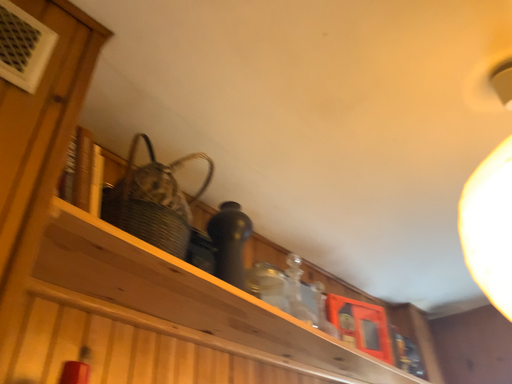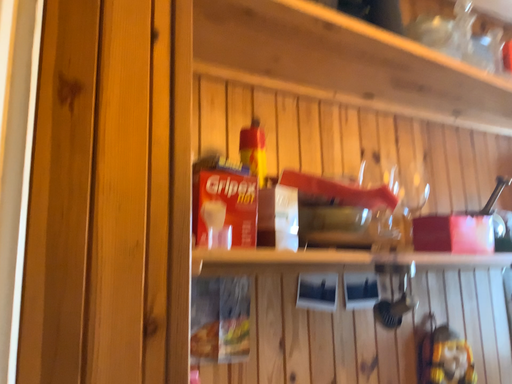
Question: Which way did the camera rotate in the video?

Choices:
 (A) rotated right
 (B) rotated left

Answer: (B)